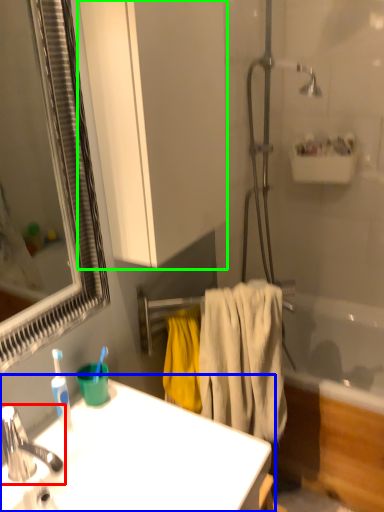
Question: Which is farther away from tap (highlighted by a red box)? sink (highlighted by a blue box) or bathroom cabinet (highlighted by a green box)?

Choices:
 (A) sink
 (B) bathroom cabinet

Answer: (B)